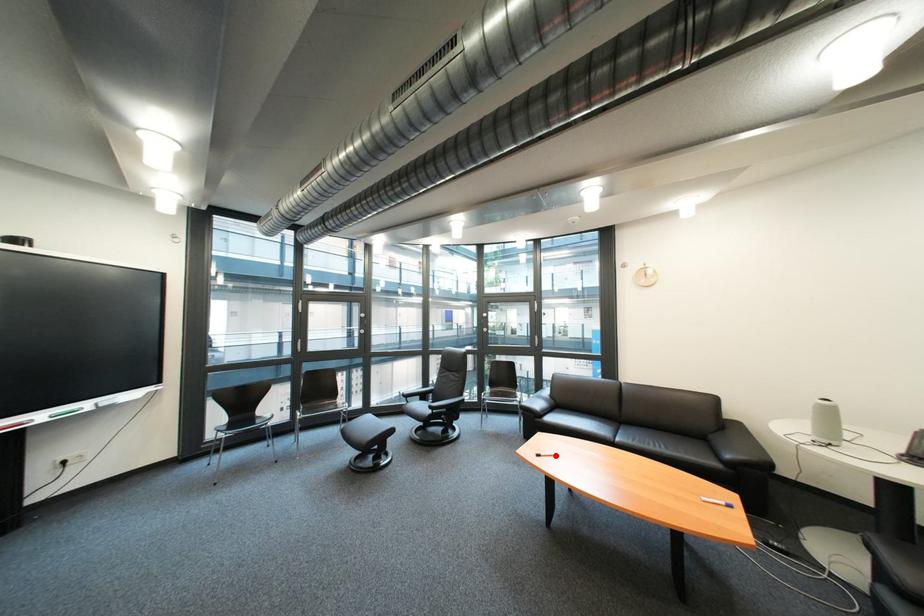
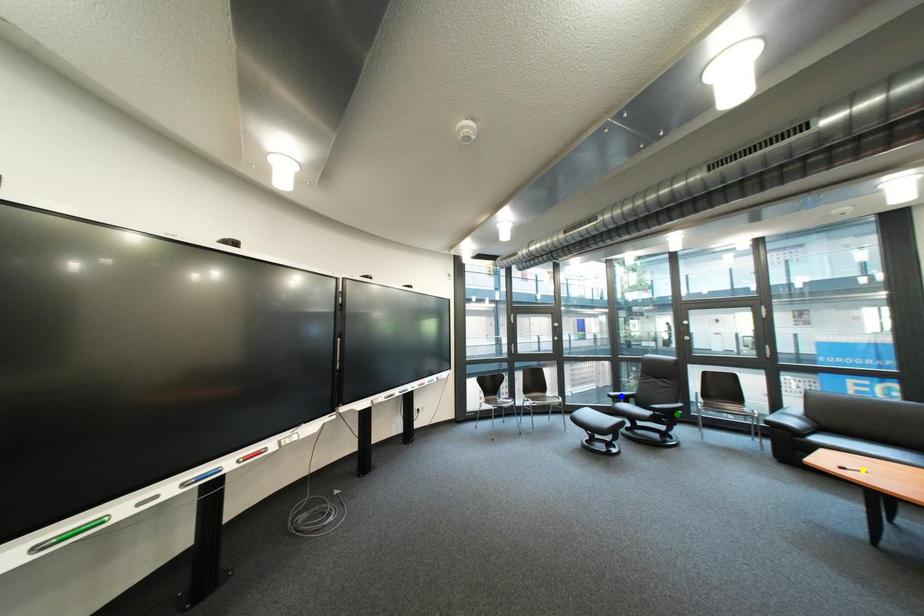
Question: I am providing you with two images of the same scene from different viewpoints. A red point is marked on the first image. You are given multiple points on the second image. Can you choose the point in image 2 that corresponds to the point in image 1?

Choices:
 (A) blue point
 (B) yellow point
 (C) green point

Answer: (B)